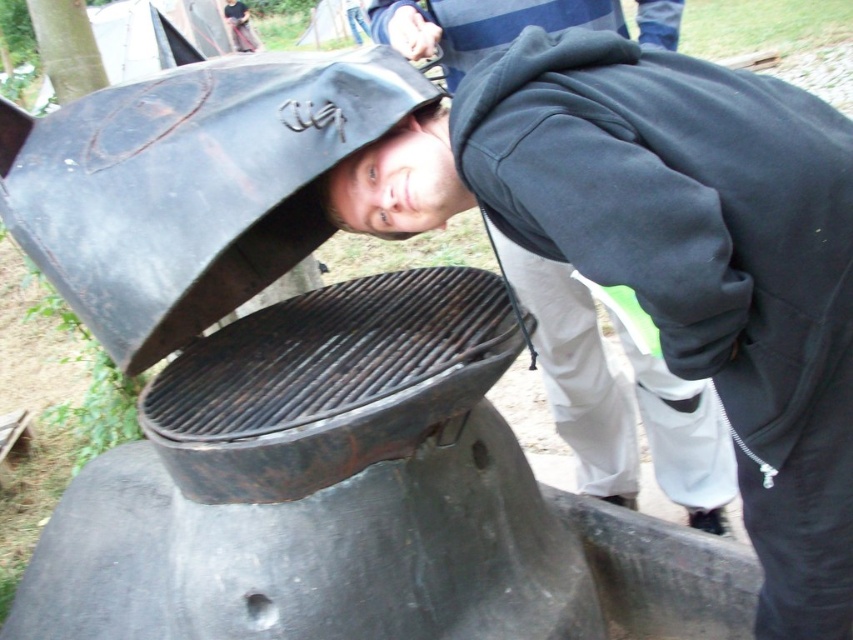
You are a photographer holding a camera. You want to take a picture of the dark blue fleece at center without moving the fleece. Can you move closer to the camera to get a better shot?

The dark blue fleece at center and camera are 4.25 feet apart. To get a better shot, you can move closer to the camera, reducing the distance between you and the camera, which would allow you to capture more detail of the dark blue fleece at center.

You are a photographer trying to capture a closeup of the dark blue fleece at center and the rusty metal grill at center. Since you want both objects to be in focus, which one should you focus on first to ensure proper depth of field?

The dark blue fleece at center is taller than the rusty metal grill at center, so you should focus on the rusty metal grill at center first to ensure proper depth of field.

You are planning to place a new decorative mat on the ground between the dark blue fleece at center and the rusty metal grill at center. Given their sizes, which object should the mat be closer to?

The dark blue fleece at center has a smaller size compared to the rusty metal grill at center, so the mat should be closer to the rusty metal grill at center to accommodate its larger size.